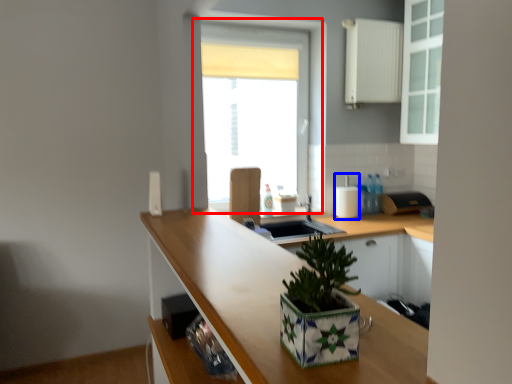
Question: Which of the following is the farthest to the observer, window (highlighted by a red box) or appliance (highlighted by a blue box)?

Choices:
 (A) window
 (B) appliance

Answer: (B)